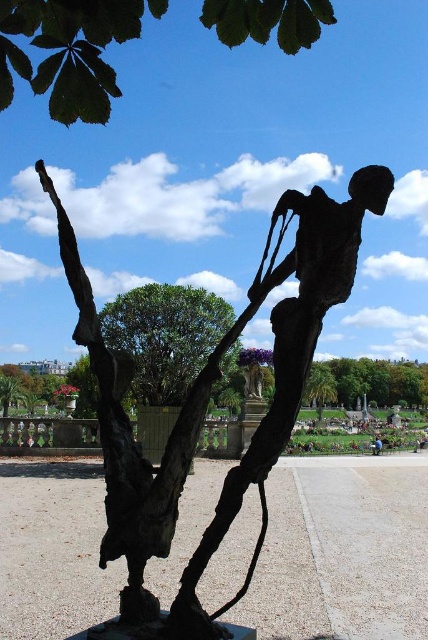
Question: Which object appears closest to the camera in this image?

Choices:
 (A) bronze sculpture at center
 (B) blue fabric person at center

Answer: (A)

Question: Which point is closer to the camera?

Choices:
 (A) (106, 460)
 (B) (291, 17)

Answer: (B)

Question: Can you confirm if bronze sculpture at center is positioned above green leafy tree at upper center?

Choices:
 (A) yes
 (B) no

Answer: (B)

Question: Which point is closer to the camera?

Choices:
 (A) green leafy tree at upper center
 (B) blue fabric person at center
 (C) bronze sculpture at center

Answer: (A)

Question: From the image, what is the correct spatial relationship of bronze sculpture at center in relation to blue fabric person at center?

Choices:
 (A) above
 (B) below

Answer: (A)

Question: In this image, where is bronze sculpture at center located relative to blue fabric person at center?

Choices:
 (A) left
 (B) right

Answer: (A)